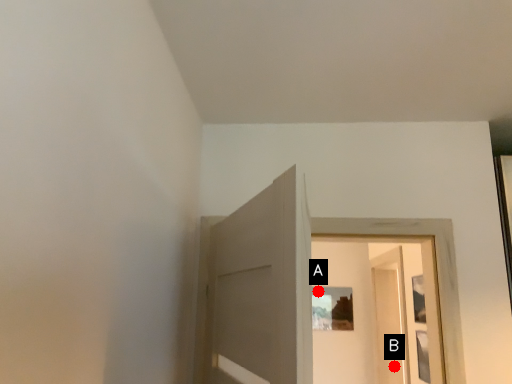
Question: Two points are circled on the image, labeled by A and B beside each circle. Which point is farther to the camera?

Choices:
 (A) A is further
 (B) B is further

Answer: (A)